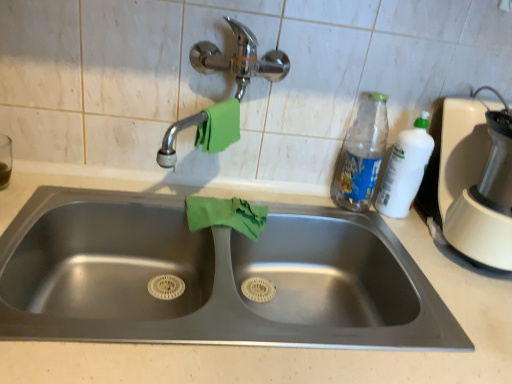
Question: From a real-world perspective, is stainless steel sink at center physically located above or below white plastic blender at right?

Choices:
 (A) below
 (B) above

Answer: (A)

Question: Considering the positions of stainless steel sink at center and white plastic blender at right in the image, is stainless steel sink at center wider or thinner than white plastic blender at right?

Choices:
 (A) thin
 (B) wide

Answer: (B)

Question: Which is farther from the white plastic blender at right?

Choices:
 (A) chrome metallic faucet at upper center
 (B) white plastic bottle at right
 (C) stainless steel sink at center
 (D) green fabric hand towel at upper center, positioned as the second hand towel in bottom-to-top order
 (E) translucent plastic bottle at upper right

Answer: (D)

Question: Which object is the farthest from the stainless steel sink at center?

Choices:
 (A) white plastic bottle at right
 (B) white plastic blender at right
 (C) chrome metallic faucet at upper center
 (D) green fabric hand towel at upper center, positioned as the second hand towel in bottom-to-top order
 (E) green cloth at sink, placed as the 1th hand towel when sorted from bottom to top

Answer: (B)